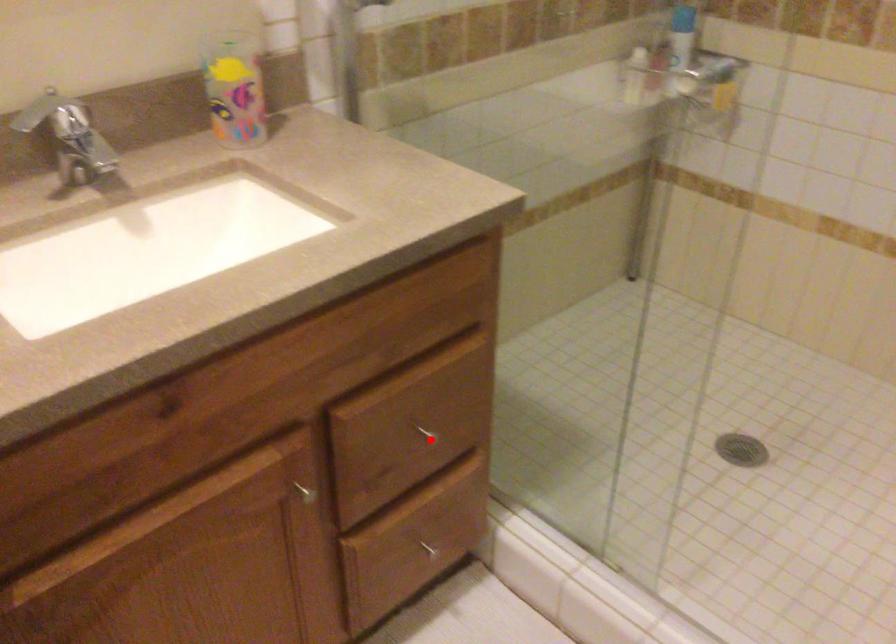
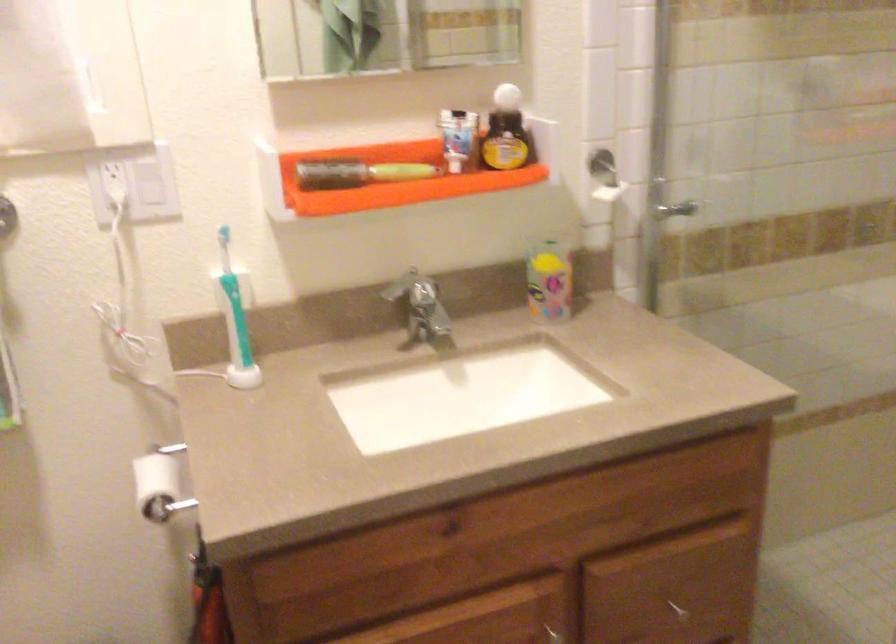
Find the pixel in the second image that matches the highlighted location in the first image.

(677, 609)